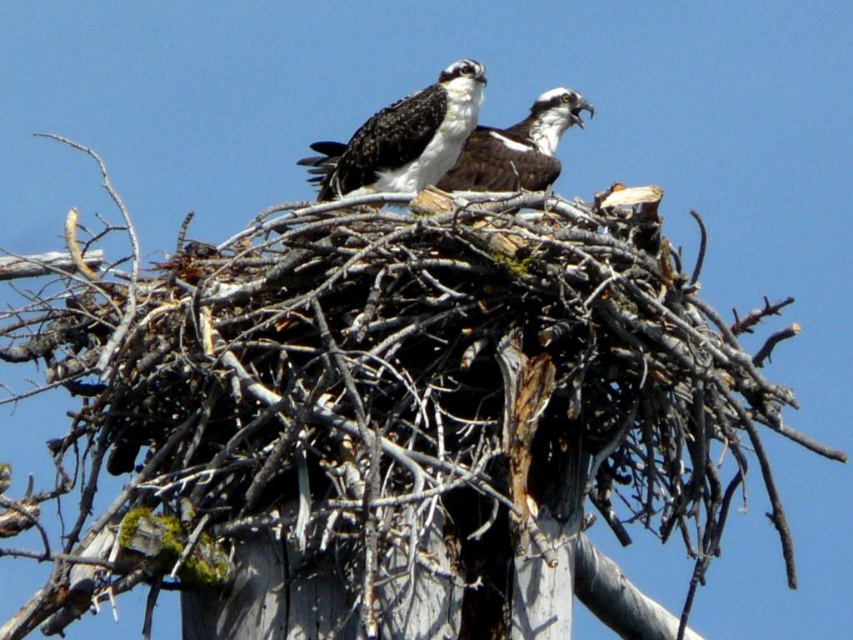
The height and width of the screenshot is (640, 853). In order to click on black and white feathers at center in this screenshot , I will do `click(409, 138)`.

Does black and white feathers at center appear on the left side of white glossy bird at center?

Correct, you'll find black and white feathers at center to the left of white glossy bird at center.

Between point (405, 116) and point (514, 161), which one is positioned behind?

Positioned behind is point (514, 161).

Find the location of a particular element. black and white feathers at center is located at coordinates (409, 138).